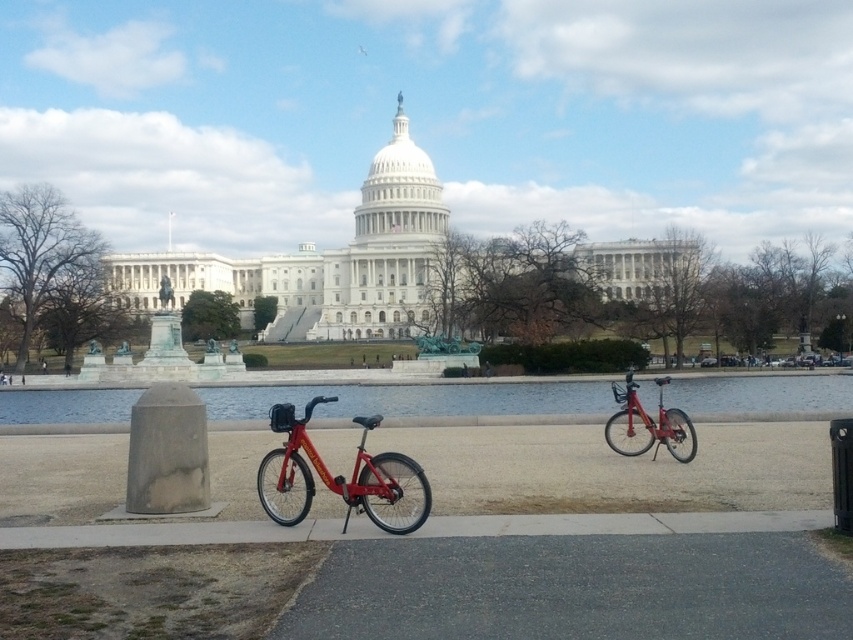
Question: Is metallic red bicycle at center further to camera compared to metallic red bicycle at right?

Choices:
 (A) yes
 (B) no

Answer: (B)

Question: Which point is closer to the camera?

Choices:
 (A) metallic red bicycle at center
 (B) metallic red bicycle at right

Answer: (A)

Question: Does clear water at center come in front of metallic red bicycle at center?

Choices:
 (A) yes
 (B) no

Answer: (B)

Question: Which point appears closest to the camera in this image?

Choices:
 (A) (288, 396)
 (B) (659, 433)

Answer: (B)

Question: Which of the following is the farthest from the observer?

Choices:
 (A) metallic red bicycle at center
 (B) clear water at center

Answer: (B)

Question: Is clear water at center wider than metallic red bicycle at right?

Choices:
 (A) no
 (B) yes

Answer: (B)